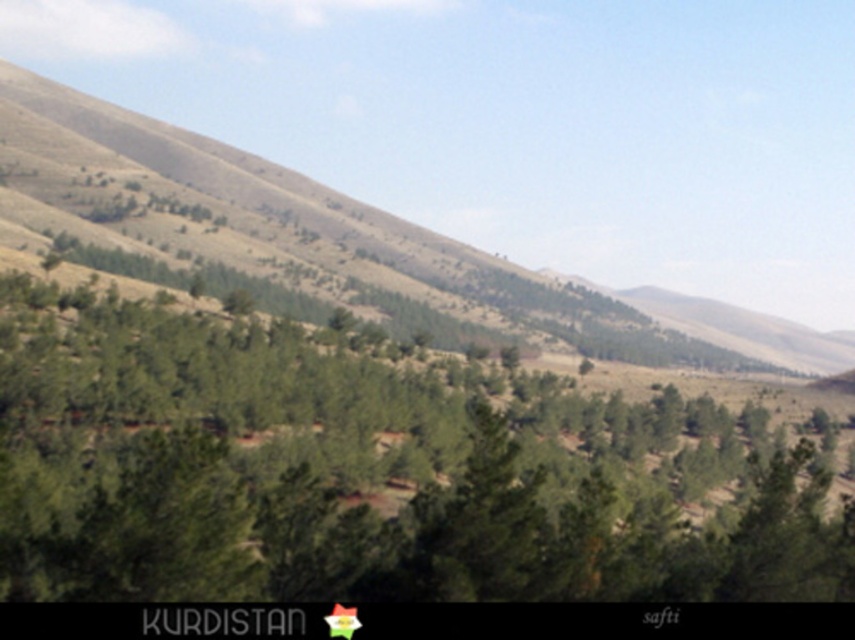
Question: Can you confirm if green leafy tree at center is smaller than green grassy hillside at center?

Choices:
 (A) yes
 (B) no

Answer: (A)

Question: Which of the following is the farthest from the observer?

Choices:
 (A) green grassy hillside at center
 (B) green leafy tree at center

Answer: (A)

Question: Can you confirm if green leafy tree at center is wider than green grassy hillside at center?

Choices:
 (A) yes
 (B) no

Answer: (B)

Question: Is green leafy tree at center to the left of green grassy hillside at center from the viewer's perspective?

Choices:
 (A) yes
 (B) no

Answer: (A)